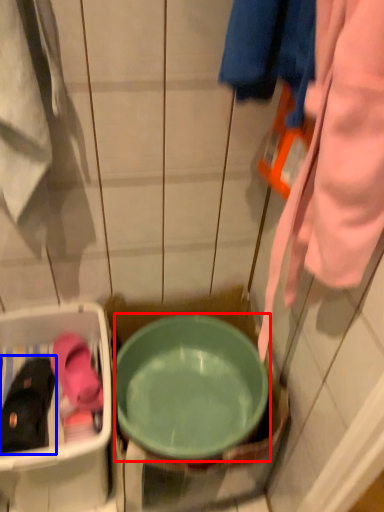
Question: Which object appears closest to the camera in this image, basin (highlighted by a red box) or footwear (highlighted by a blue box)?

Choices:
 (A) basin
 (B) footwear

Answer: (A)